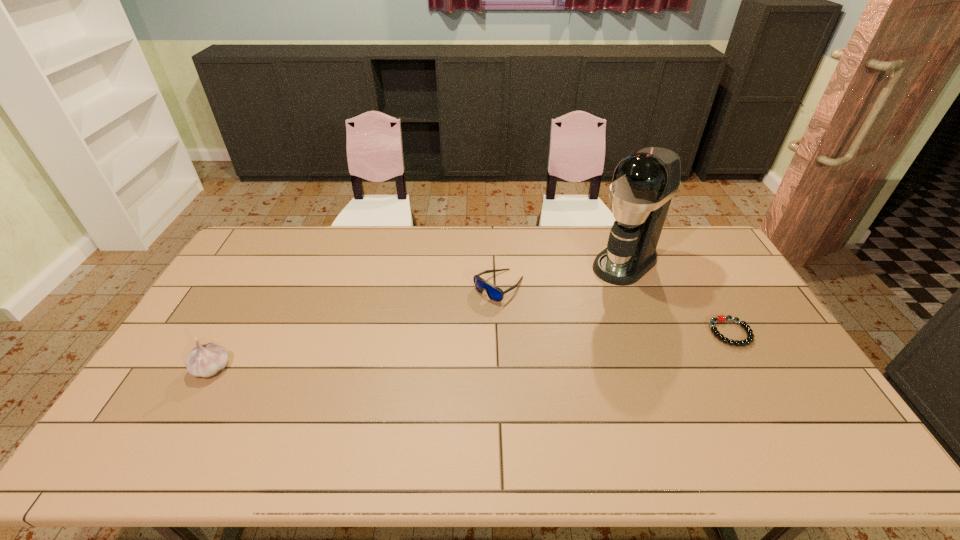
Find the location of a particular element. vacant space at the near edge of the desktop is located at coordinates (729, 424).

The image size is (960, 540). What are the coordinates of `free spot at the right edge of the desktop` in the screenshot? It's located at (745, 299).

In the image, there is a desktop. At what (x,y) coordinates should I click in order to perform the action: click on vacant region at the far right corner. Please return your answer as a coordinate pair (x, y). Looking at the image, I should click on (696, 264).

At what (x,y) coordinates should I click in order to perform the action: click on vacant point located between the garlic and the coffee maker. Please return your answer as a coordinate pair (x, y). Image resolution: width=960 pixels, height=540 pixels. Looking at the image, I should click on (419, 315).

What are the coordinates of `vacant area between the third farthest object and the second shortest object` in the screenshot? It's located at (614, 309).

Image resolution: width=960 pixels, height=540 pixels. In order to click on unoccupied area between the shortest object and the nearest object in this screenshot , I will do `click(471, 350)`.

The height and width of the screenshot is (540, 960). What are the coordinates of `empty space between the leftmost object and the bracelet` in the screenshot? It's located at (471, 350).

You are a GUI agent. You are given a task and a screenshot of the screen. Output one action in this format:
    pyautogui.click(x=<x>, y=<y>)
    Task: Click on the vacant point located between the leftmost object and the tallest object
    
    Given the screenshot: What is the action you would take?
    pyautogui.click(x=419, y=315)

This screenshot has height=540, width=960. In order to click on free space between the second shortest object and the third object from left to right in this screenshot , I will do `click(562, 274)`.

You are a GUI agent. You are given a task and a screenshot of the screen. Output one action in this format:
    pyautogui.click(x=<x>, y=<y>)
    Task: Click on the unoccupied position between the bracelet and the nearest object
    This screenshot has width=960, height=540.
    Given the screenshot: What is the action you would take?
    pyautogui.click(x=471, y=350)